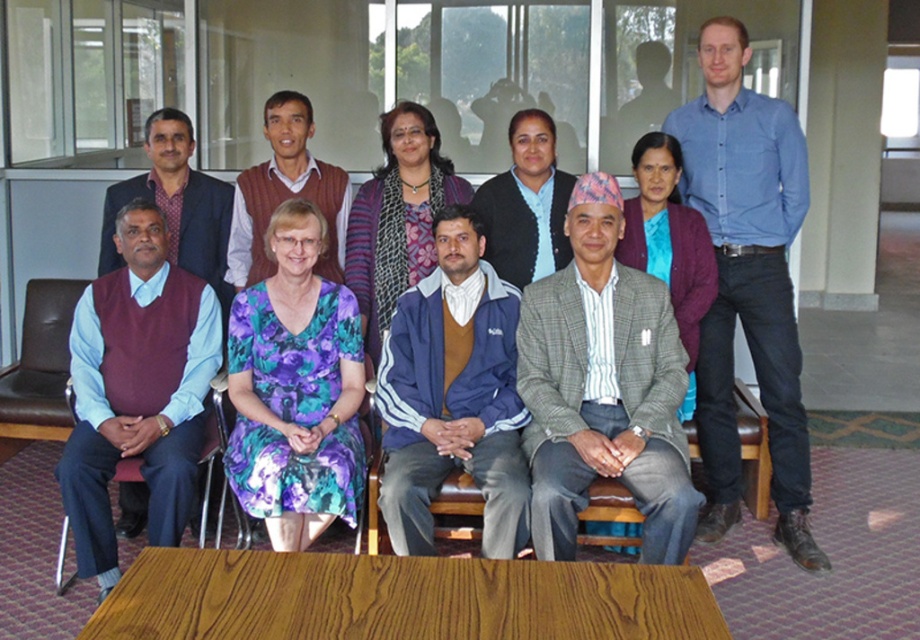
Locate an element on the screen. Image resolution: width=920 pixels, height=640 pixels. blue denim shirt at upper right is located at coordinates (746, 280).

Does point (692, 180) come behind point (391, 131)?

No.

Where is `blue denim shirt at upper right`? The image size is (920, 640). blue denim shirt at upper right is located at coordinates (746, 280).

Who is shorter, blue fabric jacket at center or purple woolen sweater at center?

purple woolen sweater at center

Between blue fabric jacket at center and purple woolen sweater at center, which one appears on the left side from the viewer's perspective?

blue fabric jacket at center is more to the left.

Find the location of a particular element. This screenshot has height=640, width=920. blue fabric jacket at center is located at coordinates (453, 396).

Who is positioned more to the left, floral dress at center or black woolen sweater at center?

From the viewer's perspective, floral dress at center appears more on the left side.

Where is `floral dress at center`? floral dress at center is located at coordinates (295, 388).